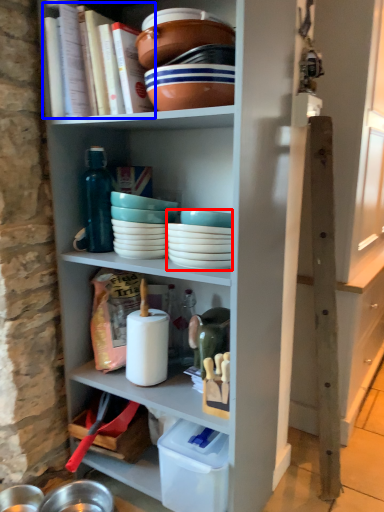
Question: Among these objects, which one is nearest to the camera, tableware (highlighted by a red box) or book (highlighted by a blue box)?

Choices:
 (A) tableware
 (B) book

Answer: (B)